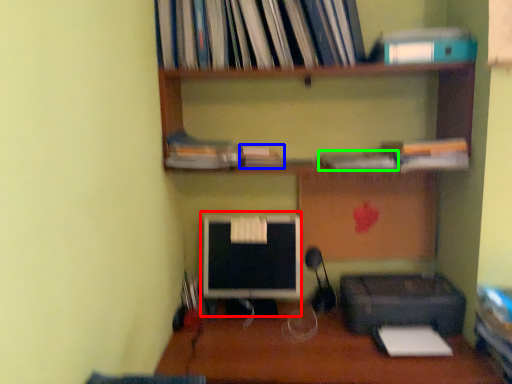
Question: Which object is positioned farthest from computer monitor (highlighted by a red box)? Select from book (highlighted by a blue box) and book (highlighted by a green box).

Choices:
 (A) book
 (B) book

Answer: (B)